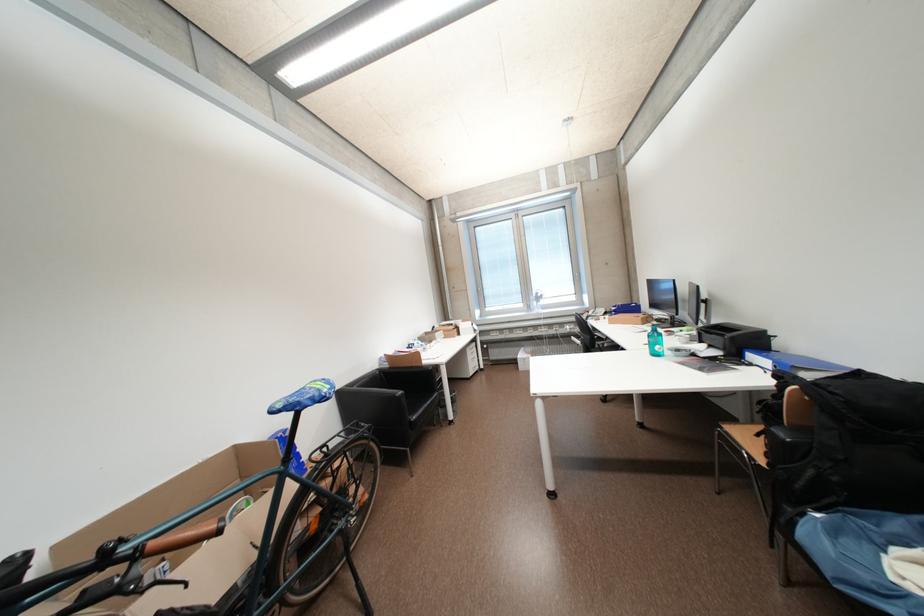
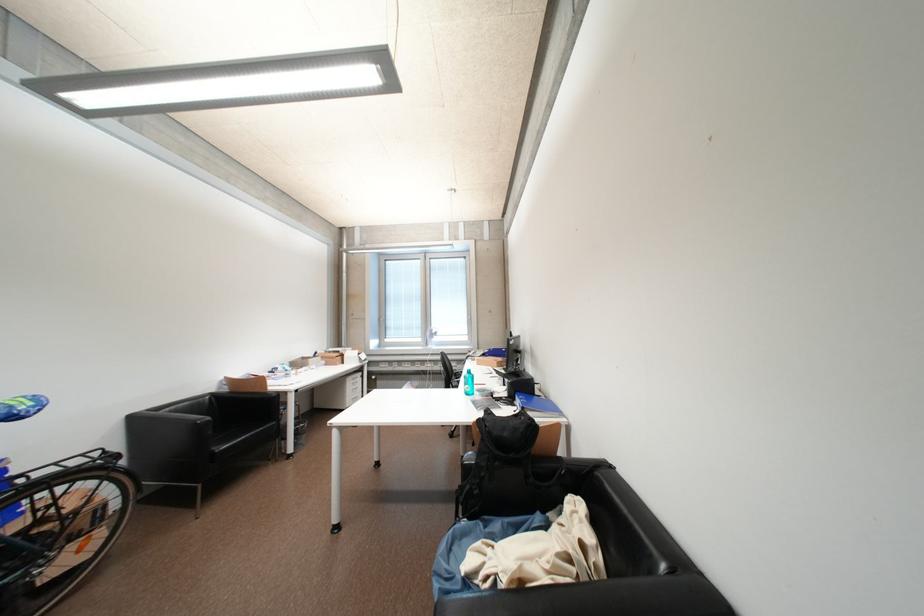
In the second image, find the point that corresponds to the point at 394,368 in the first image.

(234, 391)